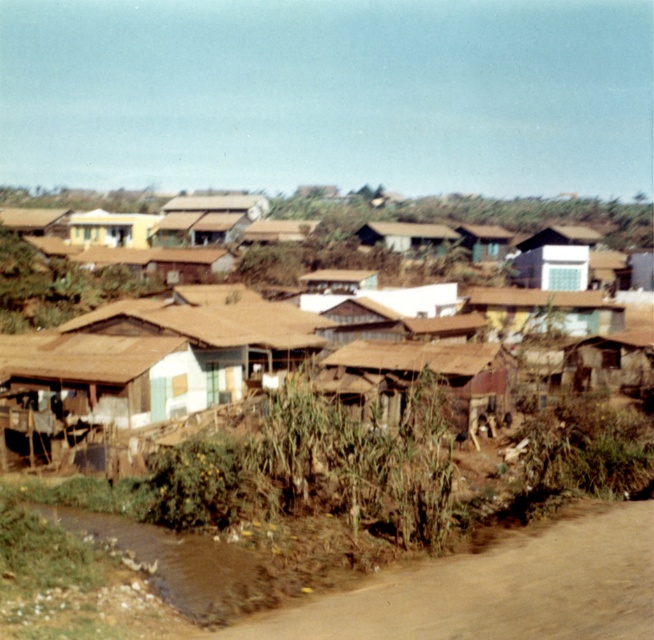
Question: Can you confirm if brown thatched roof houses at center is positioned above brown wooden hut at center?

Choices:
 (A) yes
 (B) no

Answer: (A)

Question: Which object appears closest to the camera in this image?

Choices:
 (A) brown dirt track at lower right
 (B) brown wooden hut at center
 (C) brown thatched roof houses at center
 (D) brown corrugated metal hut at center

Answer: (A)

Question: Which object appears closest to the camera in this image?

Choices:
 (A) brown corrugated metal hut at center
 (B) brown dirt track at lower right
 (C) brown wooden hut at center
 (D) brown thatched roof houses at center

Answer: (B)

Question: Can you confirm if brown thatched roof houses at center is bigger than brown dirt track at lower right?

Choices:
 (A) no
 (B) yes

Answer: (B)

Question: Does brown thatched roof houses at center have a lesser width compared to brown dirt track at lower right?

Choices:
 (A) no
 (B) yes

Answer: (A)

Question: Among these objects, which one is farthest from the camera?

Choices:
 (A) brown thatched roof houses at center
 (B) brown corrugated metal hut at center
 (C) brown wooden hut at center
 (D) brown dirt track at lower right

Answer: (B)